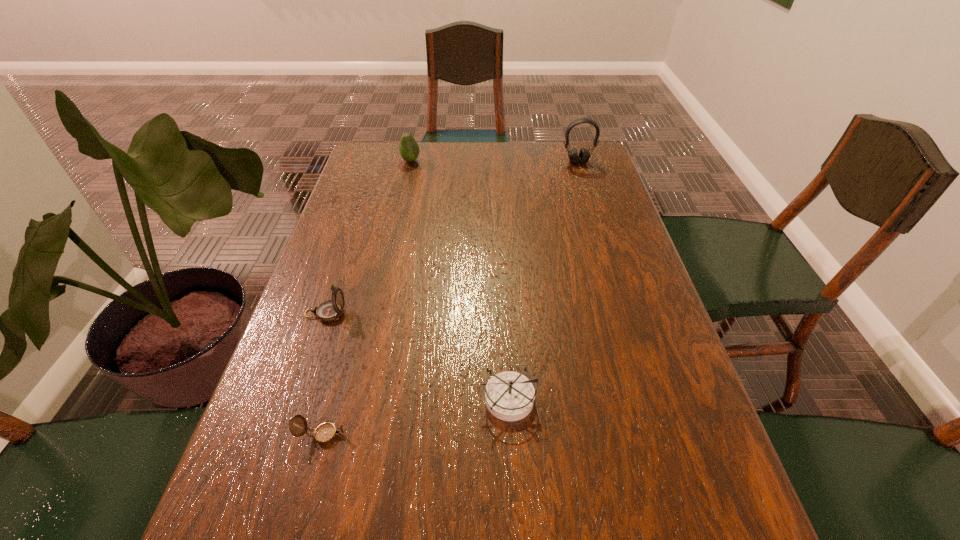
Locate an element on the screen. This screenshot has height=540, width=960. free space at the far edge of the desktop is located at coordinates (479, 172).

I want to click on free space at the left edge, so click(x=390, y=186).

In the image, there is a desktop. Identify the location of vacant space at the right edge. (671, 389).

This screenshot has height=540, width=960. What are the coordinates of `free region at the far left corner of the desktop` in the screenshot? It's located at (390, 145).

At what (x,y) coordinates should I click in order to perform the action: click on free space between the rightmost object and the avocado. Please return your answer as a coordinate pair (x, y). This screenshot has width=960, height=540. Looking at the image, I should click on (494, 161).

At what (x,y) coordinates should I click in order to perform the action: click on free space between the tallest object and the rightmost compass. Please return your answer as a coordinate pair (x, y). This screenshot has height=540, width=960. Looking at the image, I should click on (542, 280).

Locate an element on the screen. This screenshot has width=960, height=540. free space between the headset and the shortest compass is located at coordinates [450, 298].

The height and width of the screenshot is (540, 960). What are the coordinates of `free point between the second shortest object and the rightmost object` in the screenshot? It's located at (542, 280).

Where is `vacant region between the third nearest object and the headset`? The width and height of the screenshot is (960, 540). vacant region between the third nearest object and the headset is located at coordinates (452, 238).

At what (x,y) coordinates should I click in order to perform the action: click on vacant area between the avocado and the shortest object. Please return your answer as a coordinate pair (x, y). The height and width of the screenshot is (540, 960). Looking at the image, I should click on (367, 298).